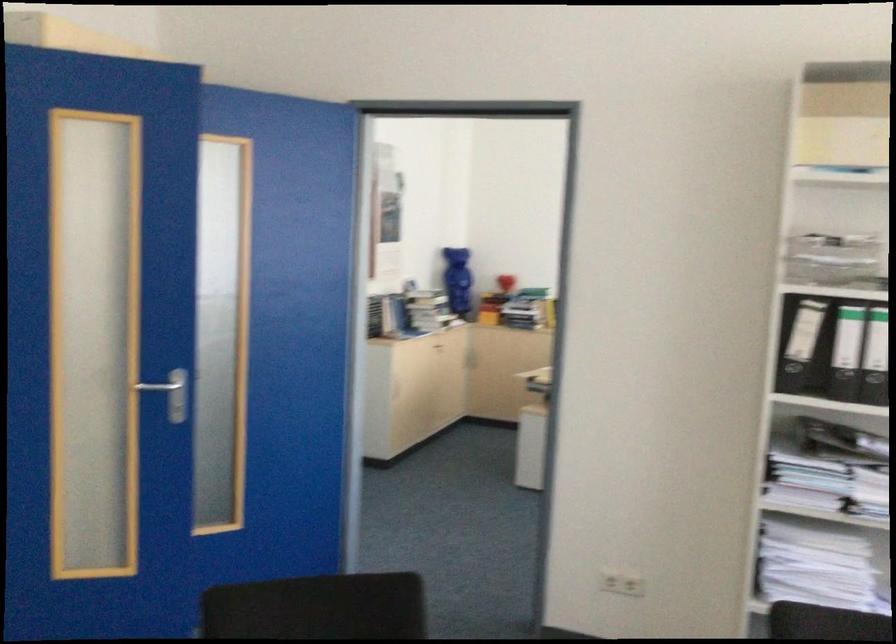
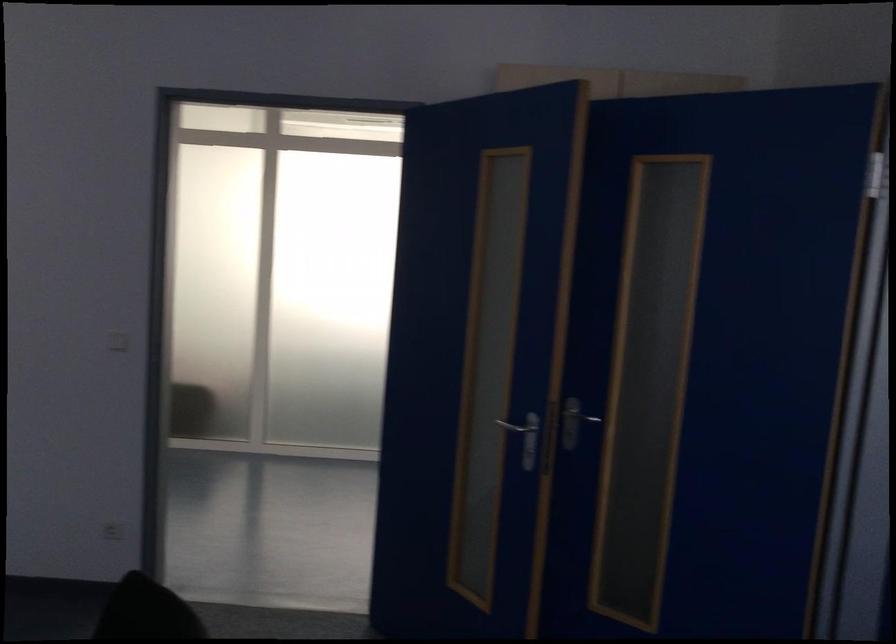
Locate, in the second image, the point that corresponds to point 76,418 in the first image.

(528, 438)